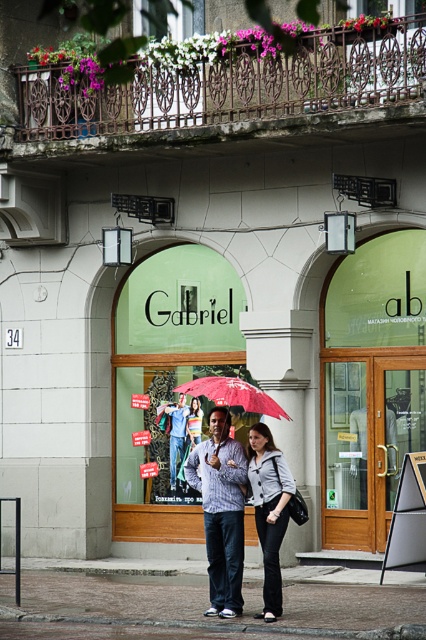
Question: Which object is farther from the camera taking this photo?

Choices:
 (A) matte gray blazer at center
 (B) red matte umbrella at center
 (C) matte gray sweater at center

Answer: (C)

Question: Is brown brick pavement at center positioned before matte gray sweater at center?

Choices:
 (A) yes
 (B) no

Answer: (A)

Question: Is denim pants at center in front of matte gray sweater at center?

Choices:
 (A) no
 (B) yes

Answer: (A)

Question: Is the position of matte blue jeans at center less distant than that of matte gray sweater at center?

Choices:
 (A) yes
 (B) no

Answer: (A)

Question: Among these objects, which one is farthest from the camera?

Choices:
 (A) denim pants at center
 (B) red matte umbrella at center
 (C) matte gray sweater at center

Answer: (A)

Question: Which object is closer to the camera taking this photo?

Choices:
 (A) denim pants at center
 (B) matte gray blazer at center
 (C) brown brick pavement at center

Answer: (B)